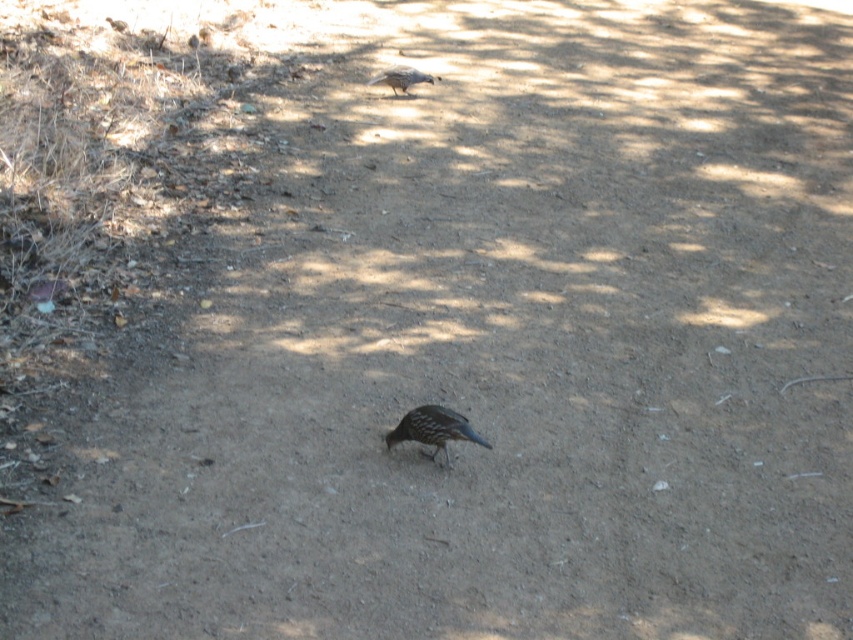
Question: Which of the following is the closest to the observer?

Choices:
 (A) blue glossy bird at center
 (B) brown speckled bird at upper center

Answer: (A)

Question: Can you confirm if blue glossy bird at center is positioned to the left of brown speckled bird at upper center?

Choices:
 (A) no
 (B) yes

Answer: (A)

Question: Is blue glossy bird at center positioned before brown speckled bird at upper center?

Choices:
 (A) no
 (B) yes

Answer: (B)

Question: Which point is farther to the camera?

Choices:
 (A) brown speckled bird at upper center
 (B) blue glossy bird at center

Answer: (A)

Question: Does blue glossy bird at center appear on the left side of brown speckled bird at upper center?

Choices:
 (A) no
 (B) yes

Answer: (A)